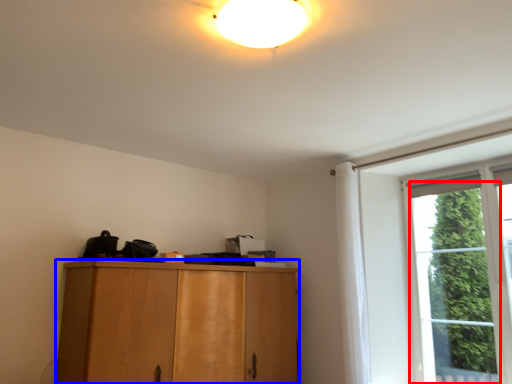
Question: Which of the following is the farthest to the observer, window (highlighted by a red box) or cabinetry (highlighted by a blue box)?

Choices:
 (A) window
 (B) cabinetry

Answer: (A)